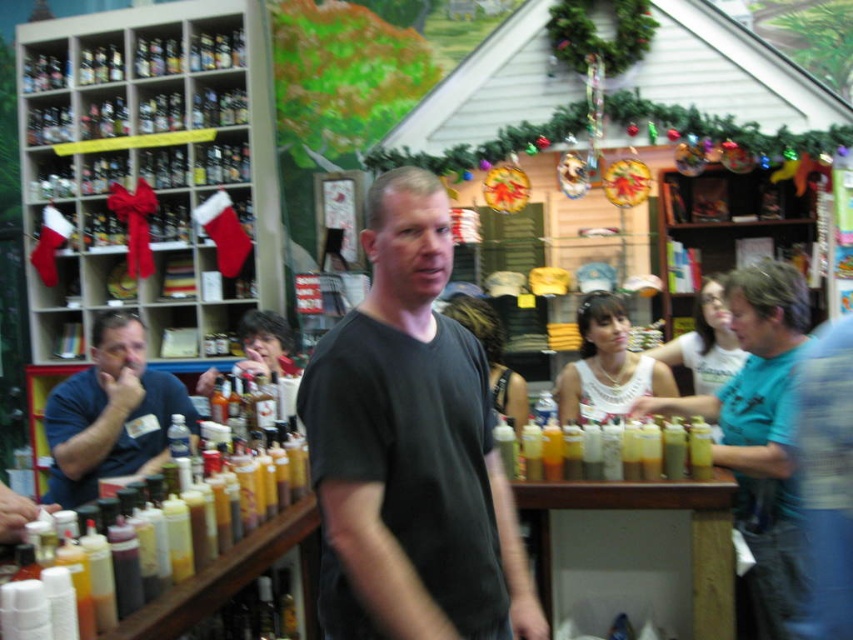
You are a customer in a clothing store and see two items at center, a white lace top at center and a matte white tank top at center. Which one is displayed higher on the rack?

The white lace top at center is displayed higher on the rack than the matte white tank top at center.

You are standing in the store and see two points marked on the floor. The first point is at coordinate point(x=306, y=371) and the second is at point(x=68, y=451). Which point is closer to you?

Point(x=306, y=371) is closer to you because it is in front of point(x=68, y=451).